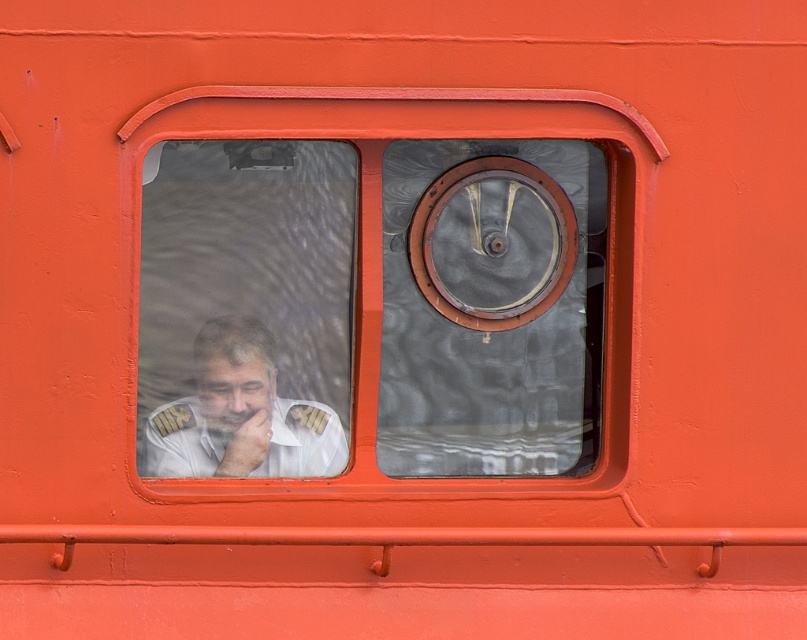
Which is in front, point (253, 476) or point (314, 406)?

Point (253, 476)

Can you confirm if transparent glass window at center is positioned to the right of white uniform at left?

Yes, transparent glass window at center is to the right of white uniform at left.

Who is more distant from viewer, (435,161) or (260,324)?

Point (260,324)

Image resolution: width=807 pixels, height=640 pixels. I want to click on transparent glass window at center, so click(x=362, y=308).